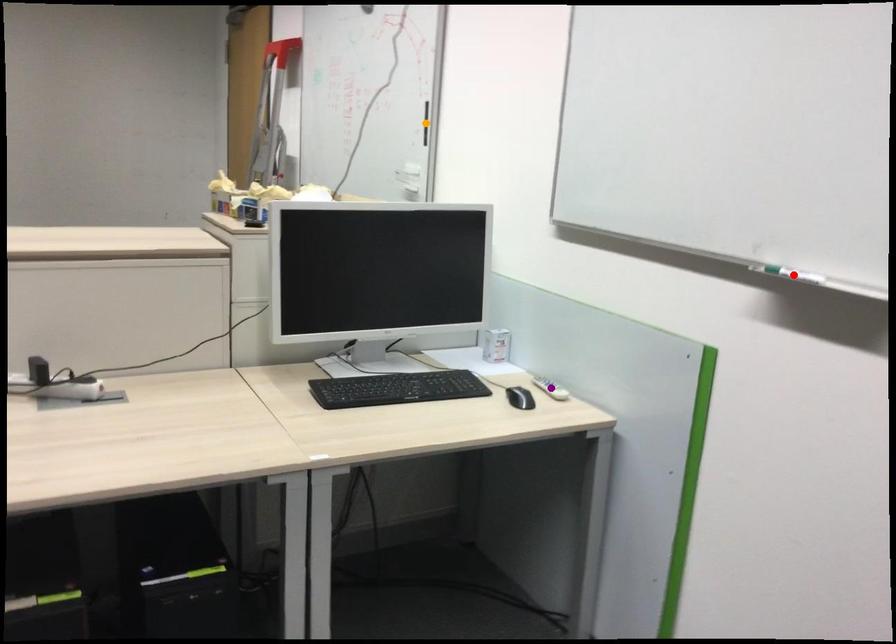
Order these from nearest to farthest:
1. red point
2. orange point
3. purple point

red point < purple point < orange point